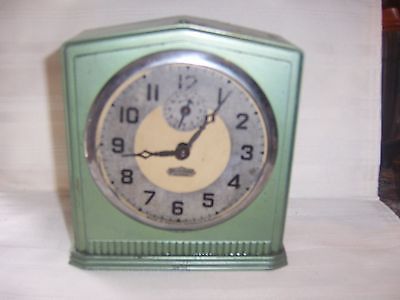
Locate an element on the screen. This screenshot has width=400, height=300. left side of clock is located at coordinates (71, 150).